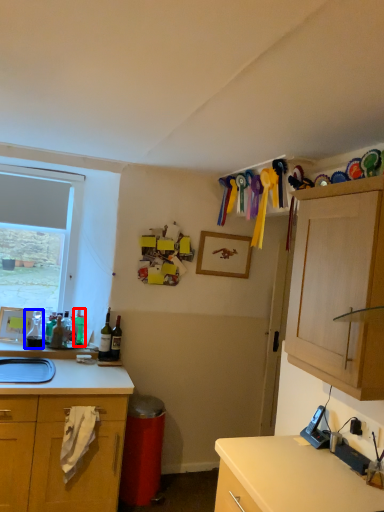
Question: Which object is closer to the camera taking this photo, bottle (highlighted by a red box) or bottle (highlighted by a blue box)?

Choices:
 (A) bottle
 (B) bottle

Answer: (B)